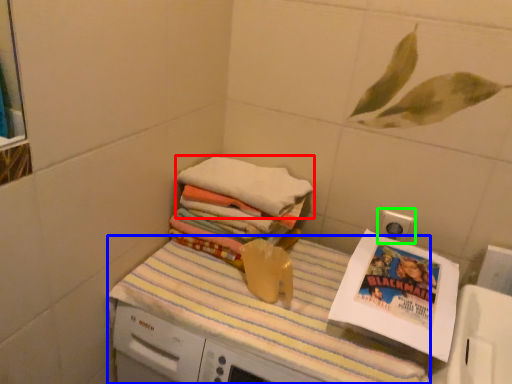
Question: Which is farther away from towel (highlighted by a red box)? tablecloth (highlighted by a blue box) or electric outlet (highlighted by a green box)?

Choices:
 (A) tablecloth
 (B) electric outlet

Answer: (B)